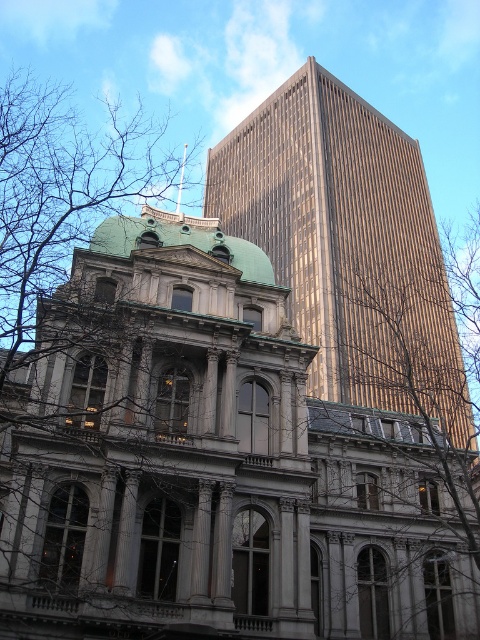
You are an architect analyzing the spatial relationship between the gold reflective glass tower at upper center and the bare branches at left. Based on their sizes, which object would appear closer to the observer?

The gold reflective glass tower at upper center is smaller in size compared to the bare branches at left, so it would appear farther away from the observer since smaller objects typically appear farther in a visual context.

You are an architect analyzing the spatial relationship between the classical building and the gold reflective glass tower at upper center. Based on their positions in the image, which object is closer to the top edge of the frame?

Result: The gold reflective glass tower at upper center is closer to the top edge of the frame because its position at point 0.725 on the y axis is higher than the classical building.

You are an architect analyzing the spatial relationship between the gold reflective glass tower at upper center and the bare branches at left. Which object has a smaller width when viewed from your perspective?

The gold reflective glass tower at upper center is thinner than the bare branches at left, so it has a smaller width.